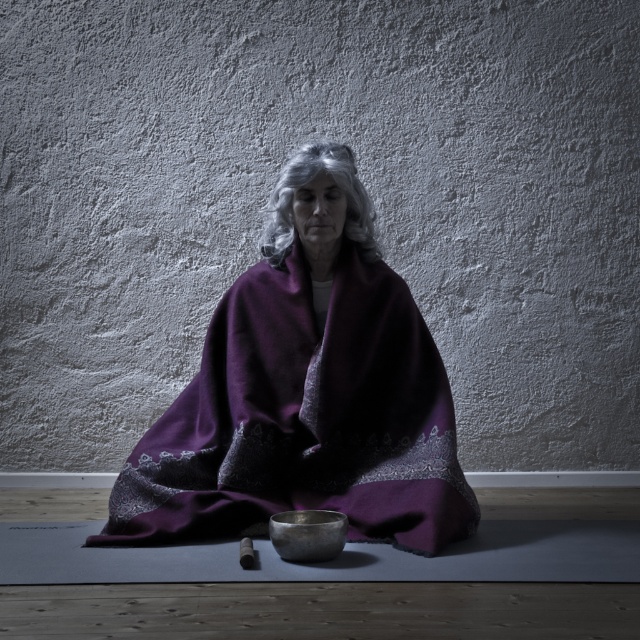
Can you confirm if purple woolen shawl at center is smaller than grayhair at center?

Incorrect, purple woolen shawl at center is not smaller in size than grayhair at center.

Can you confirm if purple woolen shawl at center is bigger than grayhair at center?

Indeed, purple woolen shawl at center has a larger size compared to grayhair at center.

Which is in front, point (128, 465) or point (376, 250)?

Point (376, 250)

Where is `purple woolen shawl at center`? purple woolen shawl at center is located at coordinates (307, 392).

Is point (278, 186) closer to viewer compared to point (332, 538)?

No, (278, 186) is further to viewer.

Can you confirm if grayhair at center is bigger than shiny metallic bowl at center?

Yes.

Locate an element on the screen. Image resolution: width=640 pixels, height=640 pixels. grayhair at center is located at coordinates (308, 180).

Who is positioned more to the left, purple woolen shawl at center or shiny metallic bowl at center?

purple woolen shawl at center is more to the left.

Based on the photo, between purple woolen shawl at center and shiny metallic bowl at center, which one is positioned lower?

Positioned lower is shiny metallic bowl at center.

This screenshot has width=640, height=640. In order to click on purple woolen shawl at center in this screenshot , I will do `click(307, 392)`.